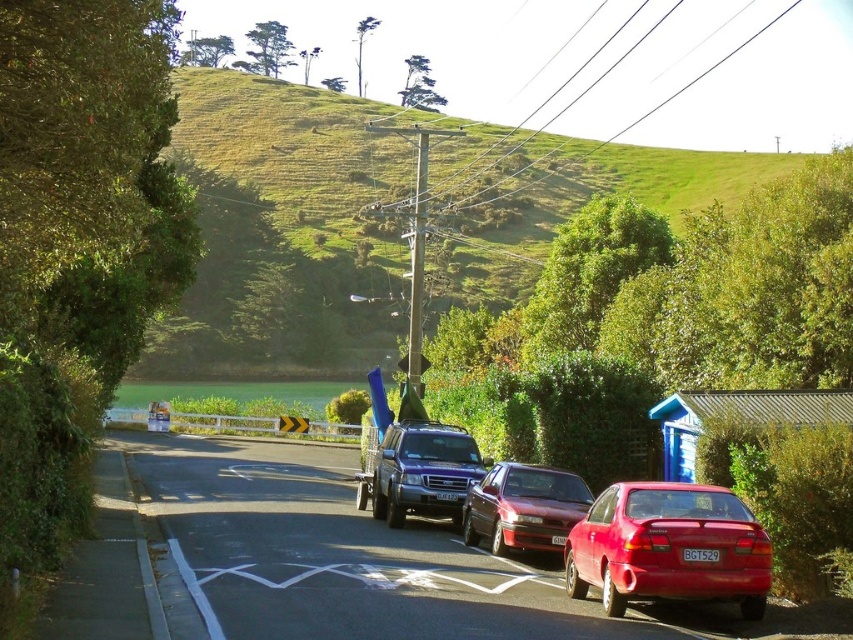
You are a delivery driver needing to park your 1.8m wide van. You see the metallic red car at center and the glossy red sedan at lower right parked on the road. Can your van fit in the space between them?

The metallic red car at center is wider than the glossy red sedan at lower right. However, the exact width of the space between them isn not provided. To determine if your van can fit, you need to measure the distance between the two vehicles. If the space is at least 1.8 meters wide, then your van can fit.